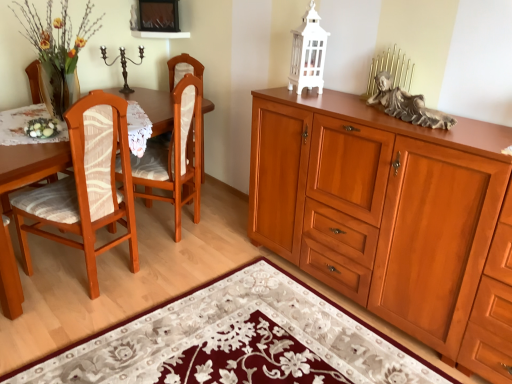
Question: From the image's perspective, is white lace tablecloth at left below gray stone statue at upper right?

Choices:
 (A) yes
 (B) no

Answer: (A)

Question: Is white lace tablecloth at left bigger than gray stone statue at upper right?

Choices:
 (A) no
 (B) yes

Answer: (B)

Question: Considering the relative sizes of white lace tablecloth at left and gray stone statue at upper right in the image provided, is white lace tablecloth at left taller than gray stone statue at upper right?

Choices:
 (A) no
 (B) yes

Answer: (B)

Question: Is white lace tablecloth at left oriented towards gray stone statue at upper right?

Choices:
 (A) yes
 (B) no

Answer: (B)

Question: Would you consider white lace tablecloth at left to be distant from gray stone statue at upper right?

Choices:
 (A) yes
 (B) no

Answer: (A)

Question: In terms of width, does wooden cabinet at right look wider or thinner when compared to floral rug at lower center?

Choices:
 (A) wide
 (B) thin

Answer: (B)

Question: In terms of size, does wooden cabinet at right appear bigger or smaller than floral rug at lower center?

Choices:
 (A) big
 (B) small

Answer: (A)

Question: From the image's perspective, is wooden cabinet at right located above or below floral rug at lower center?

Choices:
 (A) below
 (B) above

Answer: (B)

Question: Does point (401, 206) appear closer or farther from the camera than point (187, 327)?

Choices:
 (A) closer
 (B) farther

Answer: (A)

Question: From a real-world perspective, is floral rug at lower center physically located above or below wooden cabinet at right?

Choices:
 (A) below
 (B) above

Answer: (A)

Question: Relative to wooden cabinet at right, is floral rug at lower center in front or behind?

Choices:
 (A) front
 (B) behind

Answer: (A)

Question: Is floral rug at lower center situated inside wooden cabinet at right or outside?

Choices:
 (A) outside
 (B) inside

Answer: (A)

Question: From their relative heights in the image, would you say floral rug at lower center is taller or shorter than wooden cabinet at right?

Choices:
 (A) short
 (B) tall

Answer: (A)

Question: Does point (181, 77) appear closer or farther from the camera than point (325, 309)?

Choices:
 (A) farther
 (B) closer

Answer: (A)

Question: Considering the positions of wooden chair at left, which is the 2th chair from front to back, and floral rug at lower center in the image, is wooden chair at left, which is the 2th chair from front to back, bigger or smaller than floral rug at lower center?

Choices:
 (A) small
 (B) big

Answer: (B)